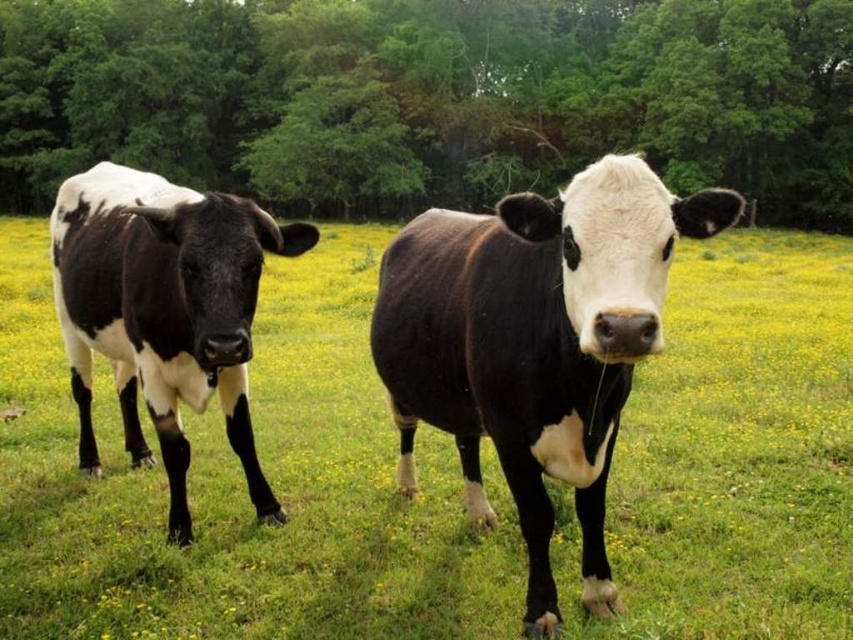
Can you confirm if black and white cow at center is positioned to the right of green leafy tree at upper center?

Yes, black and white cow at center is to the right of green leafy tree at upper center.

Find the location of a particular element. This screenshot has width=853, height=640. black and white cow at center is located at coordinates (242, 486).

Where is `black and white cow at center`? black and white cow at center is located at coordinates (242, 486).

Does green leafy tree at upper center have a greater height compared to black and white cow at left?

Yes.

Can you confirm if green leafy tree at upper center is wider than black and white cow at left?

Correct, the width of green leafy tree at upper center exceeds that of black and white cow at left.

Between point (762, 148) and point (183, 340), which one is positioned in front?

Positioned in front is point (183, 340).

Identify the location of green leafy tree at upper center. The image size is (853, 640). (431, 99).

This screenshot has width=853, height=640. I want to click on green leafy tree at upper center, so click(x=431, y=99).

Between green leafy tree at upper center and black glossy cow at center, which one appears on the right side from the viewer's perspective?

From the viewer's perspective, black glossy cow at center appears more on the right side.

You are a GUI agent. You are given a task and a screenshot of the screen. Output one action in this format:
    pyautogui.click(x=<x>, y=<y>)
    Task: Click on the green leafy tree at upper center
    The width and height of the screenshot is (853, 640).
    Given the screenshot: What is the action you would take?
    pyautogui.click(x=431, y=99)